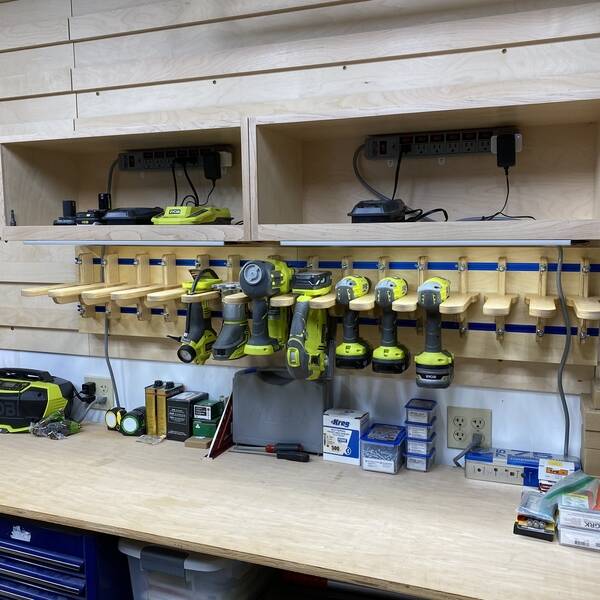
The image size is (600, 600). In order to click on power socket in this screenshot , I will do `click(458, 421)`, `click(457, 432)`, `click(477, 424)`, `click(102, 386)`.